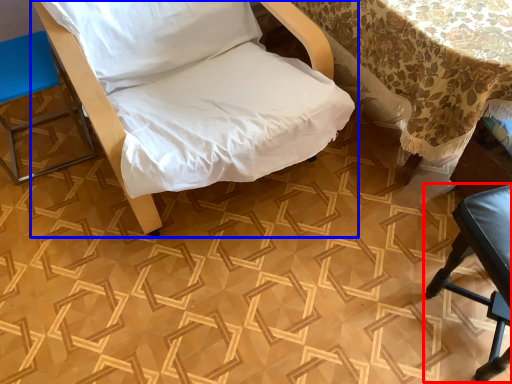
Question: Which object is further to the camera taking this photo, furniture (highlighted by a red box) or furniture (highlighted by a blue box)?

Choices:
 (A) furniture
 (B) furniture

Answer: (A)